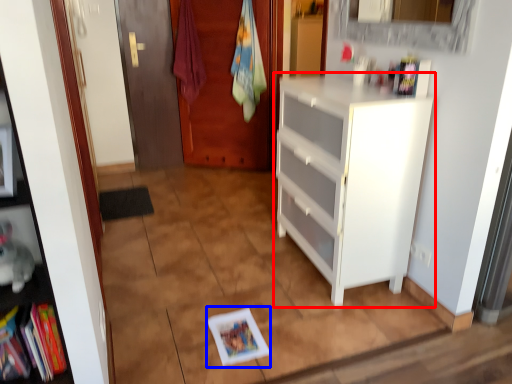
Question: Which of the following is the farthest to the observer, cabinetry (highlighted by a red box) or book (highlighted by a blue box)?

Choices:
 (A) cabinetry
 (B) book

Answer: (B)